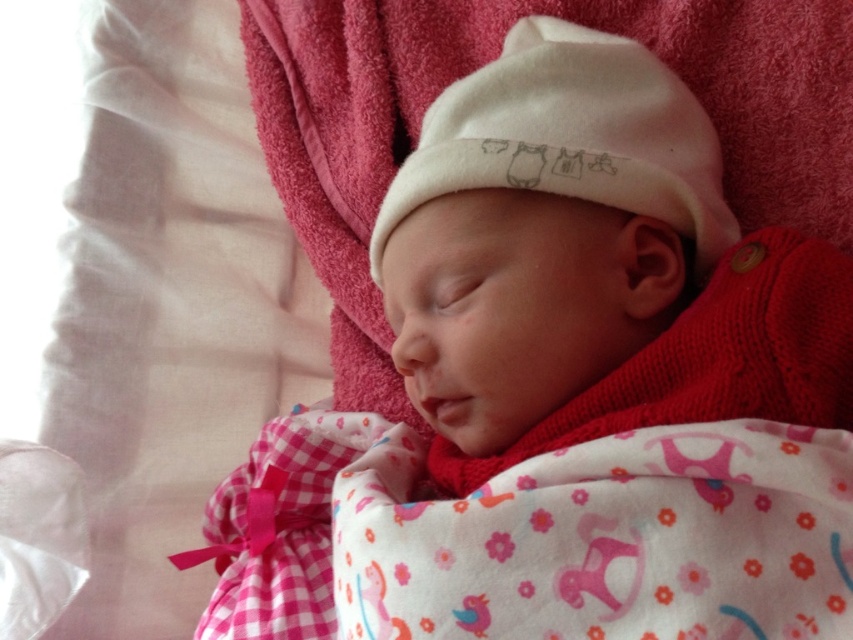
You are a nurse in a nursery and need to choose a hat for a newborn baby. You have two options on the table in front of you labeled as the white soft hat at center and the white cotton hat at center. Based on the image provided, which hat should you pick if you want the one that covers more of the baby?

The white soft hat at center is larger in size than the white cotton hat at center, so you should pick the white soft hat at center to cover more of the baby.

Looking at this image, you are a photographer setting up a newborn photo session. You notice two hats on the baby, a white soft hat at center and a white cotton hat at center. Which hat is positioned to the right of the other?

The white soft hat at center is to the right of the white cotton hat at center.

You are a photographer setting up a newborn photo session. You notice the baby has two hats on their head. The hats are labeled as the white soft hat at center and the white cotton hat at center. Which hat is visible on top of the baby?

The white soft hat at center is visible on top of the baby because it is in front of the white cotton hat at center.